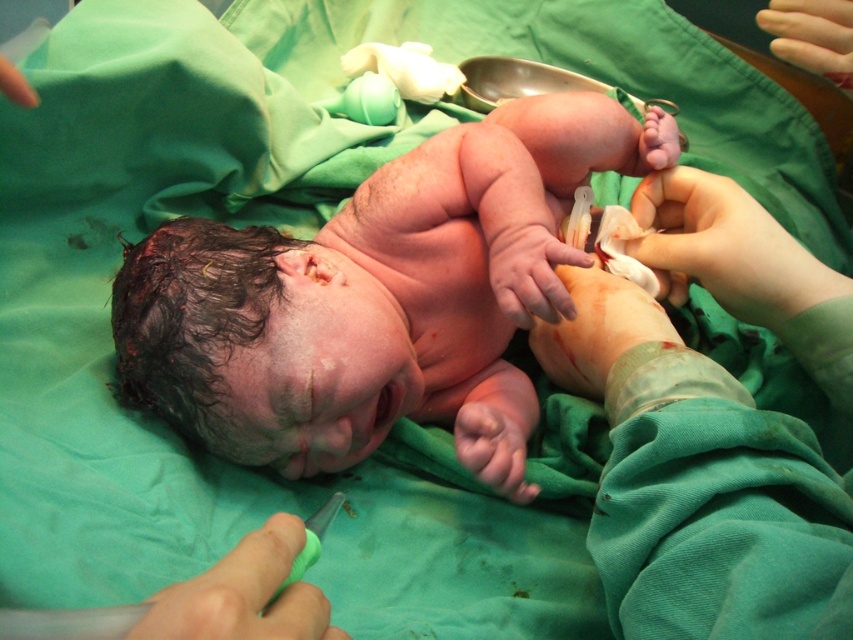
Question: Which point is farther from the camera taking this photo?

Choices:
 (A) (666, 218)
 (B) (546, 273)

Answer: (A)

Question: Which point is closer to the camera?

Choices:
 (A) (843, 4)
 (B) (146, 611)
 (C) (735, 243)

Answer: (B)

Question: Where is smooth skin hand at upper right located in relation to pale skin at upper right in the image?

Choices:
 (A) left
 (B) right

Answer: (A)

Question: Which is nearer to the pink flesh at center?

Choices:
 (A) pink flesh newborn at center
 (B) pale skin at upper right
 (C) green rubber glove at lower center
 (D) smooth skin hand at upper right

Answer: (D)

Question: Is smooth skin hand at upper right smaller than pale skin at upper right?

Choices:
 (A) yes
 (B) no

Answer: (B)

Question: Does pink flesh newborn at center have a larger size compared to green rubber glove at lower center?

Choices:
 (A) no
 (B) yes

Answer: (B)